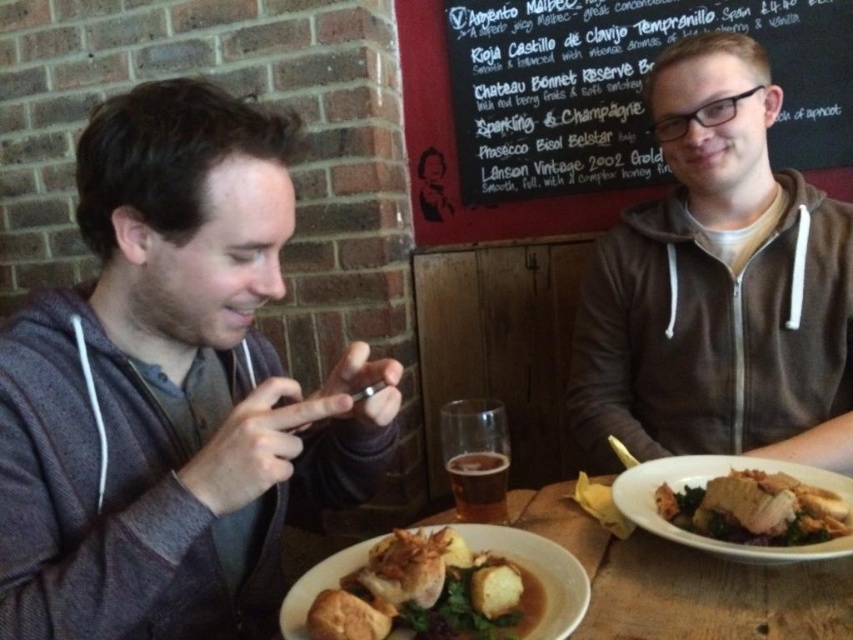
Is gray hoodie at left above brown matte glass at center?

Indeed, gray hoodie at left is positioned over brown matte glass at center.

Between gray hoodie at left and brown matte glass at center, which one appears on the left side from the viewer's perspective?

gray hoodie at left is more to the left.

Between point (219, 438) and point (463, 476), which one is positioned behind?

Point (463, 476)

You are a GUI agent. You are given a task and a screenshot of the screen. Output one action in this format:
    pyautogui.click(x=<x>, y=<y>)
    Task: Click on the gray hoodie at left
    
    Given the screenshot: What is the action you would take?
    pyautogui.click(x=171, y=388)

Which of these two, golden brown crispy chicken at right or brown matte glass at center, stands taller?

Standing taller between the two is brown matte glass at center.

What do you see at coordinates (756, 509) in the screenshot?
I see `golden brown crispy chicken at right` at bounding box center [756, 509].

Image resolution: width=853 pixels, height=640 pixels. Identify the location of golden brown crispy chicken at right. (756, 509).

Which is behind, point (694, 221) or point (822, 490)?

Positioned behind is point (694, 221).

At what (x,y) coordinates should I click in order to perform the action: click on brown zip-up hoodie at right. Please return your answer as a coordinate pair (x, y). Looking at the image, I should click on (718, 285).

Identify the location of brown zip-up hoodie at right. (718, 285).